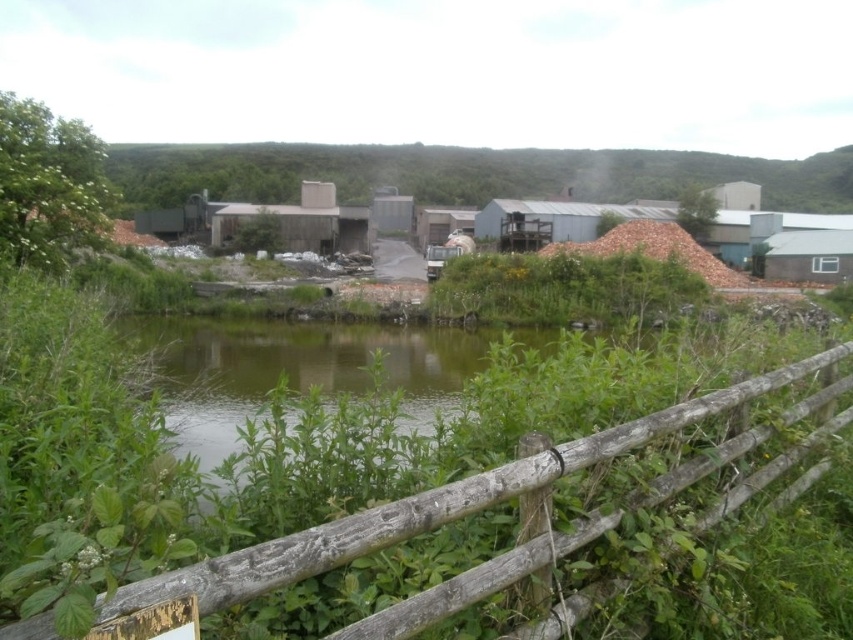
You are a landscape architect designing a new pathway through this area. You need to decide which of the two elements, the green grassy river at center or the green leafy vegetation at center, would require more elevation adjustments to accommodate the path. Based on their heights, which one would need more work?

The green leafy vegetation at center is taller than the green grassy river at center, so it would require more elevation adjustments to accommodate the path.

You are a landscape architect designing a path through this area. You need to know which object, the green grassy river at center or the green leafy bush at upper left, is wider so you can plan the path accordingly. Which one is wider?

The green grassy river at center is wider than the green leafy bush at upper left.